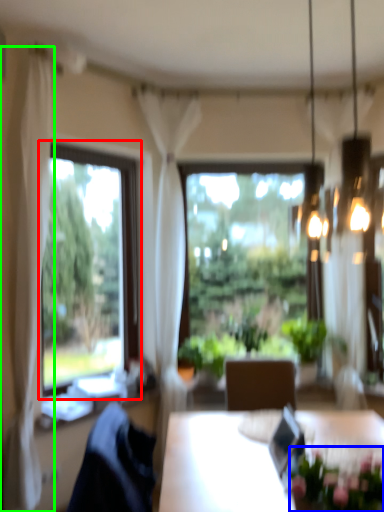
Question: Which object is the farthest from window (highlighted by a red box)? Choose among these: floral arrangement (highlighted by a blue box) or curtain (highlighted by a green box).

Choices:
 (A) floral arrangement
 (B) curtain

Answer: (A)